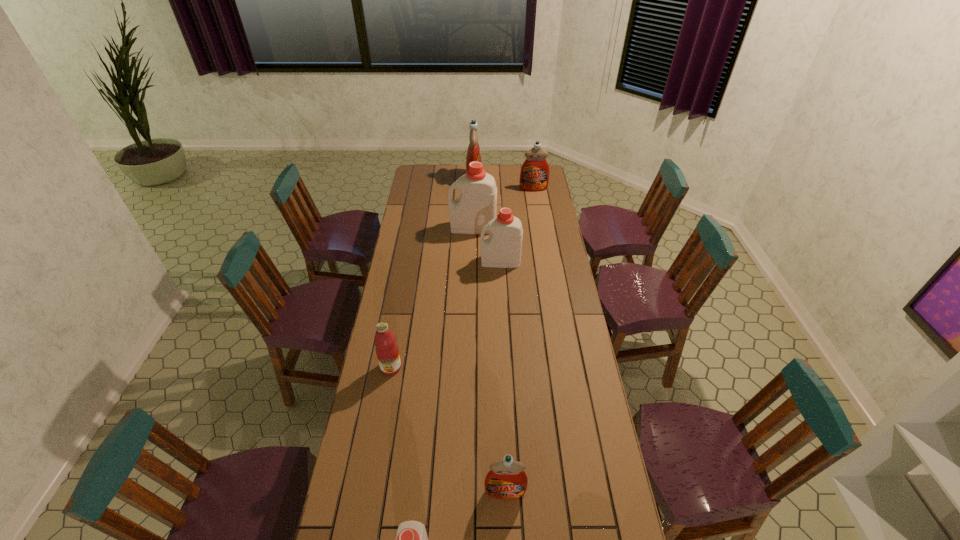
Find the location of a particular element. the leftmost red detergent is located at coordinates (473, 153).

Identify the location of the fifth nearest object. Image resolution: width=960 pixels, height=540 pixels. (477, 205).

This screenshot has width=960, height=540. I want to click on the biggest white detergent, so click(477, 205).

Identify the location of the second smallest red detergent. (534, 176).

Identify the location of the rightmost red detergent. (534, 176).

At what (x,y) coordinates should I click in order to perform the action: click on the second nearest white detergent. Please return your answer as a coordinate pair (x, y). The image size is (960, 540). Looking at the image, I should click on (502, 249).

The height and width of the screenshot is (540, 960). I want to click on the fourth farthest object, so click(x=502, y=249).

Identify the location of the fifth farthest object. (387, 351).

Where is `pink fruit juice`? pink fruit juice is located at coordinates (387, 351).

Identify the location of the second nearest object. The width and height of the screenshot is (960, 540). (506, 480).